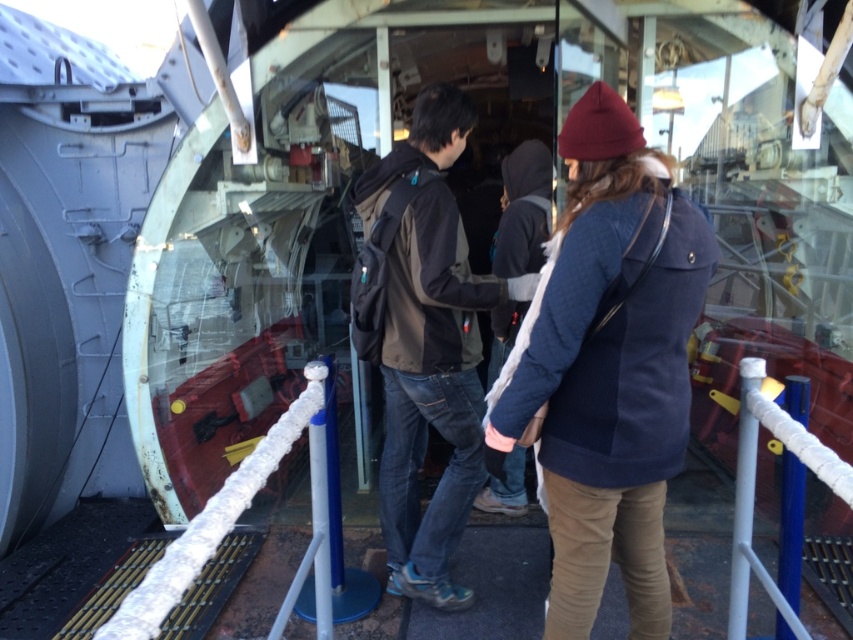
Based on the photo, can you confirm if white rope at lower left is positioned below white rope at center?

No.

Find the location of a particular element. white rope at lower left is located at coordinates (212, 522).

Who is more forward, (192,563) or (749,460)?

Point (192,563) is in front.

At what (x,y) coordinates should I click in order to perform the action: click on white rope at lower left. Please return your answer as a coordinate pair (x, y). The height and width of the screenshot is (640, 853). Looking at the image, I should click on (212, 522).

Does navy blue jacket at center appear under dark brown backpack at center?

Yes.

Is navy blue jacket at center to the right of dark brown backpack at center from the viewer's perspective?

Indeed, navy blue jacket at center is positioned on the right side of dark brown backpack at center.

Is point (558, 454) positioned after point (357, 200)?

No.

At what (x,y) coordinates should I click in order to perform the action: click on navy blue jacket at center. Please return your answer as a coordinate pair (x, y). The image size is (853, 640). Looking at the image, I should click on (608, 365).

Is point (538, 353) in front of point (198, 532)?

No, it is not.

Between navy blue jacket at center and white rope at lower left, which one is positioned lower?

white rope at lower left is lower down.

You are a GUI agent. You are given a task and a screenshot of the screen. Output one action in this format:
    pyautogui.click(x=<x>, y=<y>)
    Task: Click on the navy blue jacket at center
    Image resolution: width=853 pixels, height=640 pixels.
    Given the screenshot: What is the action you would take?
    pyautogui.click(x=608, y=365)

Locate an element on the screen. This screenshot has width=853, height=640. navy blue jacket at center is located at coordinates (608, 365).